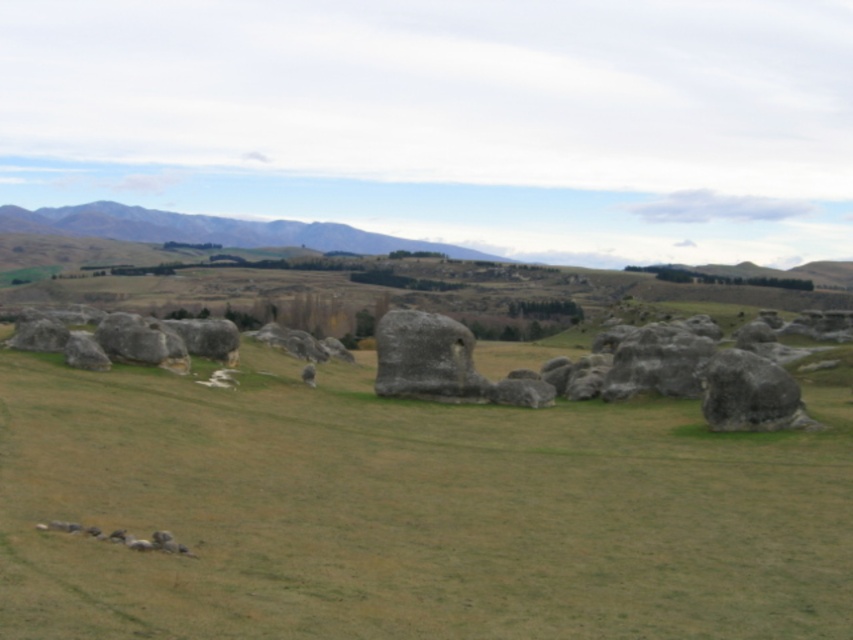
Question: Which point appears closest to the camera in this image?

Choices:
 (A) (758, 413)
 (B) (146, 353)
 (C) (538, 561)
 (D) (407, 333)

Answer: (C)

Question: Is green grassy field at center to the right of gray rough stone at center from the viewer's perspective?

Choices:
 (A) yes
 (B) no

Answer: (B)

Question: Can you confirm if green grassy hillside at upper left is positioned above smooth gray rock at center?

Choices:
 (A) yes
 (B) no

Answer: (A)

Question: Is gray rough stone at center to the left of smooth gray rock at center from the viewer's perspective?

Choices:
 (A) yes
 (B) no

Answer: (B)

Question: Among these points, which one is nearest to the camera?

Choices:
 (A) (480, 484)
 (B) (430, 369)
 (C) (148, 234)
 (D) (775, 384)

Answer: (A)

Question: Estimate the real-world distances between objects in this image. Which object is closer to the smooth gray rock at center?

Choices:
 (A) gray rough boulder at right
 (B) gray rough stone at center

Answer: (B)